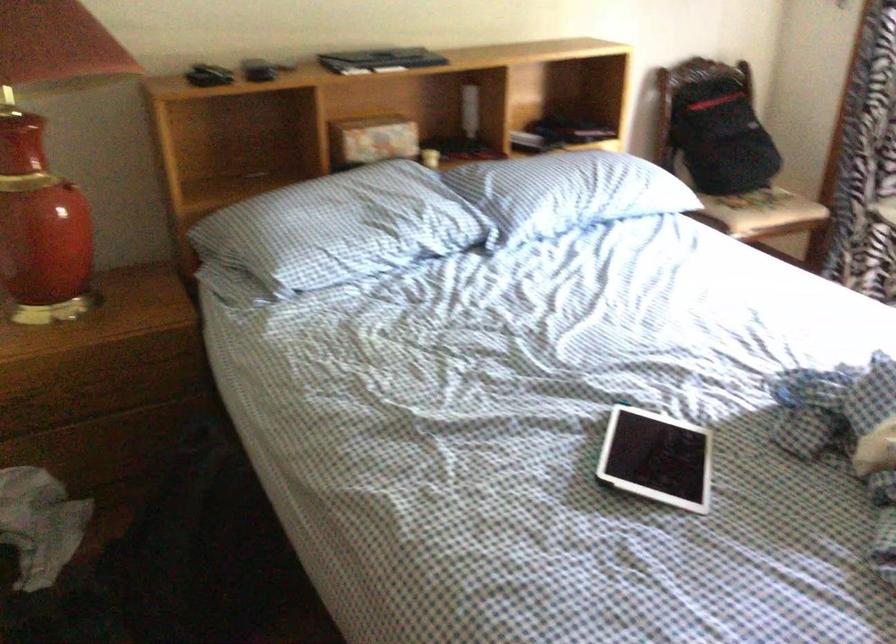
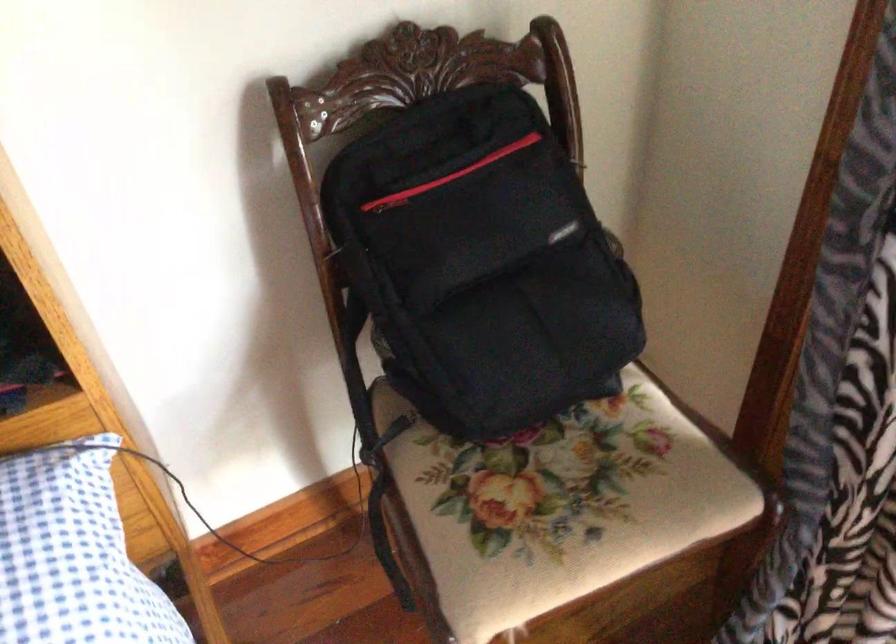
What movement of the cameraman would produce the second image?

The cameraman moved toward right, forward.